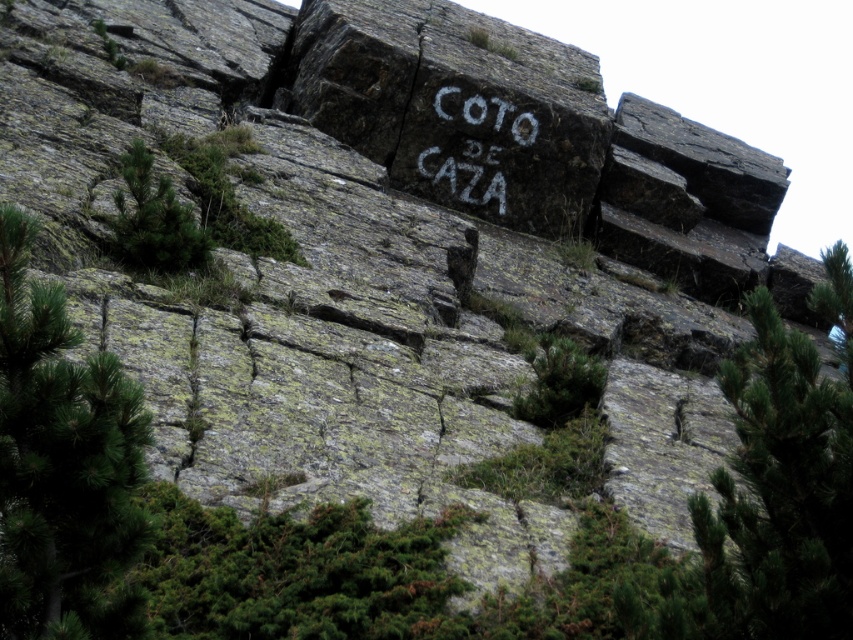
You are an artist planning to sketch the scene. You want to ensure the white chalk writing at center and the green leafy tree at left are both visible in your drawing. Given their sizes, which object should you make larger in your sketch?

The white chalk writing at center should be made larger in the sketch since its width is larger than the green leafy tree at left.

You are a hiker trying to locate the green textured pine tree at center. According to the coordinates provided, where would you find it in the image?

The green textured pine tree at center is located at point (784,480) in the image.

You are a photographer standing at the center of the rocky terrain. You want to take a photo that includes both the point at coordinates (712, 474) and the point at coordinates (445, 179). Which point will appear larger in your photo?

Point (712, 474) is closer to the camera than point (445, 179), so it will appear larger in the photo.